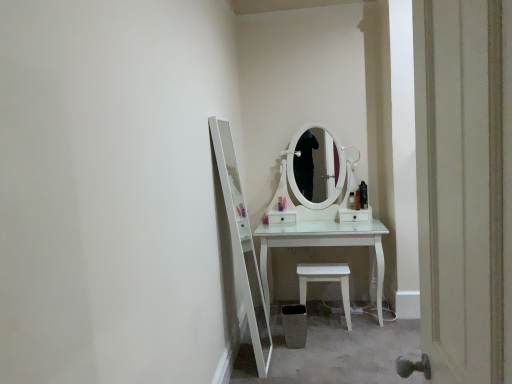
Question: Is white plastic stool at lower center inside translucent plastic bottle at center, the second toiletry from the left?

Choices:
 (A) no
 (B) yes

Answer: (A)

Question: Is translucent plastic bottle at center, the second toiletry from the left, shorter than white plastic stool at lower center?

Choices:
 (A) yes
 (B) no

Answer: (A)

Question: Does translucent plastic bottle at center, the second toiletry from the left, have a larger size compared to white plastic stool at lower center?

Choices:
 (A) yes
 (B) no

Answer: (B)

Question: From a real-world perspective, is translucent plastic bottle at center, the second toiletry from the left, over white plastic stool at lower center?

Choices:
 (A) yes
 (B) no

Answer: (A)

Question: Is the surface of translucent plastic bottle at center, which is counted as the 4th toiletry, starting from the right, in direct contact with white plastic stool at lower center?

Choices:
 (A) yes
 (B) no

Answer: (B)

Question: Is matte orange bottle at center, which is the 4th toiletry from left to right, bigger or smaller than white plastic stool at lower center?

Choices:
 (A) big
 (B) small

Answer: (B)

Question: Is point (355, 208) positioned closer to the camera than point (303, 281)?

Choices:
 (A) closer
 (B) farther

Answer: (B)

Question: Is matte orange bottle at center, which is the 4th toiletry from left to right, wider or thinner than white plastic stool at lower center?

Choices:
 (A) thin
 (B) wide

Answer: (A)

Question: In terms of height, does matte orange bottle at center, which is the 4th toiletry from left to right, look taller or shorter compared to white plastic stool at lower center?

Choices:
 (A) short
 (B) tall

Answer: (A)

Question: In terms of height, does matte black hairbrush at center, positioned as the third toiletry in right-to-left order, look taller or shorter compared to matte orange bottle at center, the 2th toiletry viewed from the right?

Choices:
 (A) short
 (B) tall

Answer: (A)

Question: Do you think matte black hairbrush at center, positioned as the third toiletry in right-to-left order, is within matte orange bottle at center, which is the 4th toiletry from left to right, or outside of it?

Choices:
 (A) inside
 (B) outside

Answer: (B)

Question: Is matte black hairbrush at center, which is counted as the 3th toiletry, starting from the left, bigger or smaller than matte orange bottle at center, which is the 4th toiletry from left to right?

Choices:
 (A) big
 (B) small

Answer: (B)

Question: Is matte black hairbrush at center, positioned as the third toiletry in right-to-left order, wider or thinner than matte orange bottle at center, the 2th toiletry viewed from the right?

Choices:
 (A) thin
 (B) wide

Answer: (A)

Question: From the image's perspective, is white wooden door at right positioned above or below matte orange bottle at center, which is the 4th toiletry from left to right?

Choices:
 (A) above
 (B) below

Answer: (B)

Question: Does point (474, 284) appear closer or farther from the camera than point (356, 200)?

Choices:
 (A) farther
 (B) closer

Answer: (B)